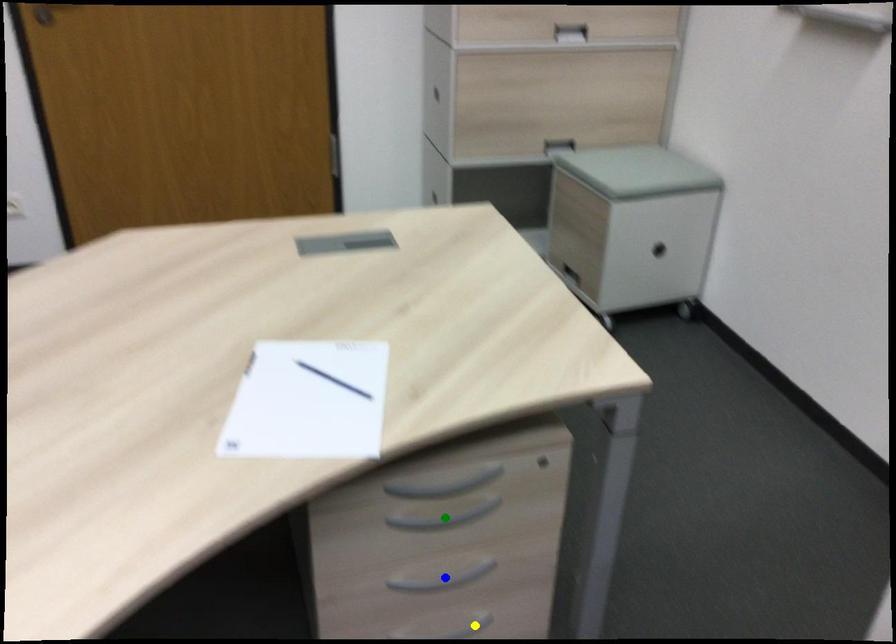
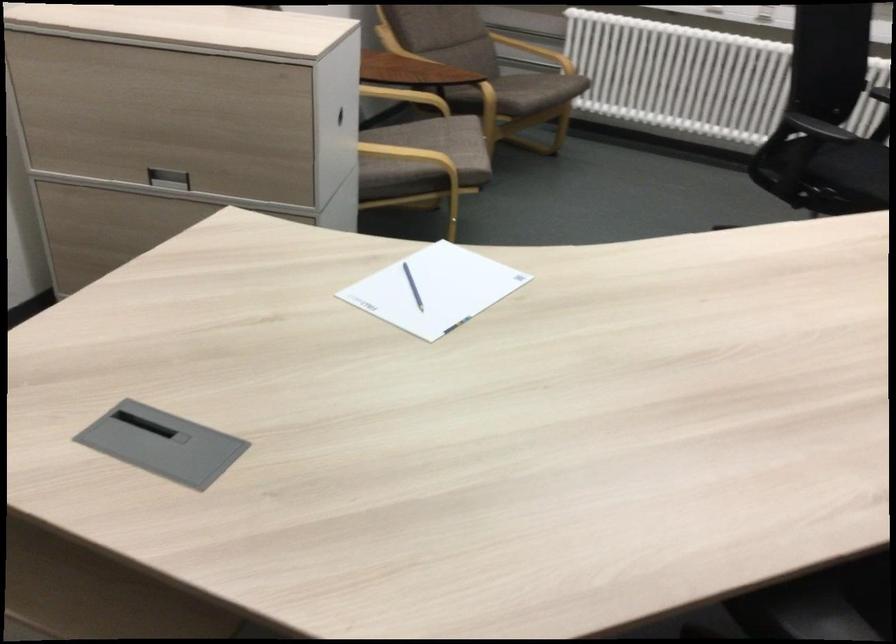
I am providing you with two images of the same scene from different viewpoints. Three points are marked in image1. Which point corresponds to a part or object that is occluded in image2?In image1, three points are marked. Which of them correspond to a part or object that is occluded in image2?Among the three points shown in image1, which one corresponds to a part or object that is no longer visible due to occlusion in image2?

Invisible in image2: green point, yellow point, blue point.